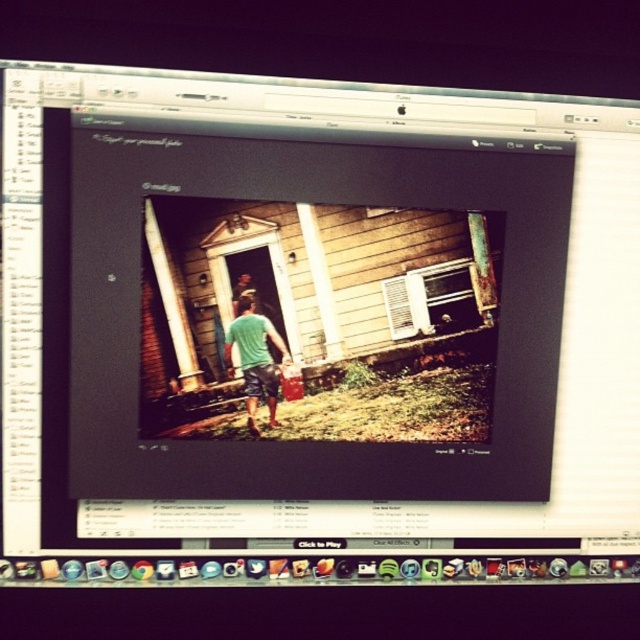
Is matte black monitor at center thinner than green cotton shirt at center?

No, matte black monitor at center is not thinner than green cotton shirt at center.

Is point (173, 259) behind point (236, 307)?

No, it is in front of (236, 307).

The height and width of the screenshot is (640, 640). I want to click on matte black monitor at center, so click(314, 308).

This screenshot has width=640, height=640. Find the location of `matte black monitor at center`. matte black monitor at center is located at coordinates (314, 308).